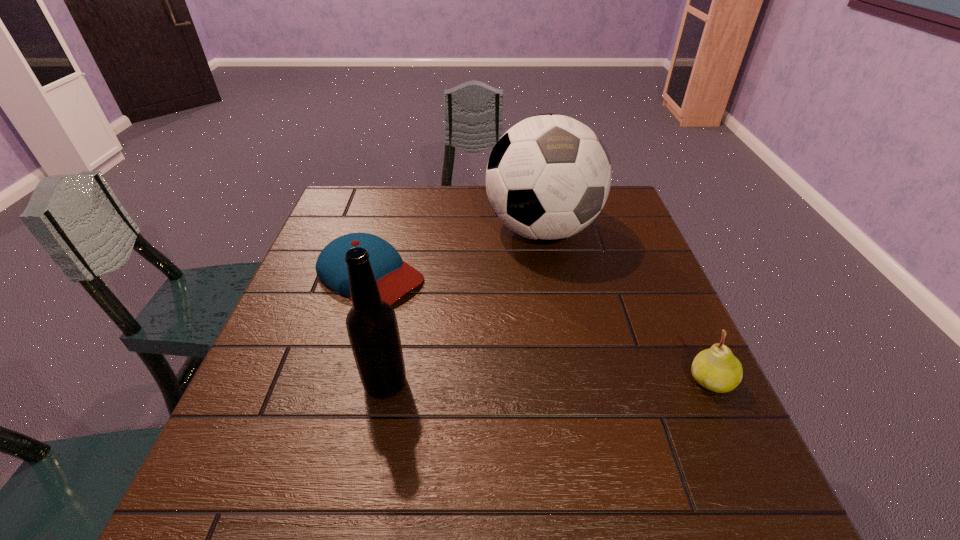
The width and height of the screenshot is (960, 540). In order to click on vacant space on the desktop that is between the beer bottle and the pear and is positioned on the main logo of the soccer ball in this screenshot , I will do `click(588, 382)`.

Find the location of `vacant space on the desktop that is between the beer bottle and the rightmost object and is positioned with the bill of the shortest object facing forward`. vacant space on the desktop that is between the beer bottle and the rightmost object and is positioned with the bill of the shortest object facing forward is located at coordinates (537, 382).